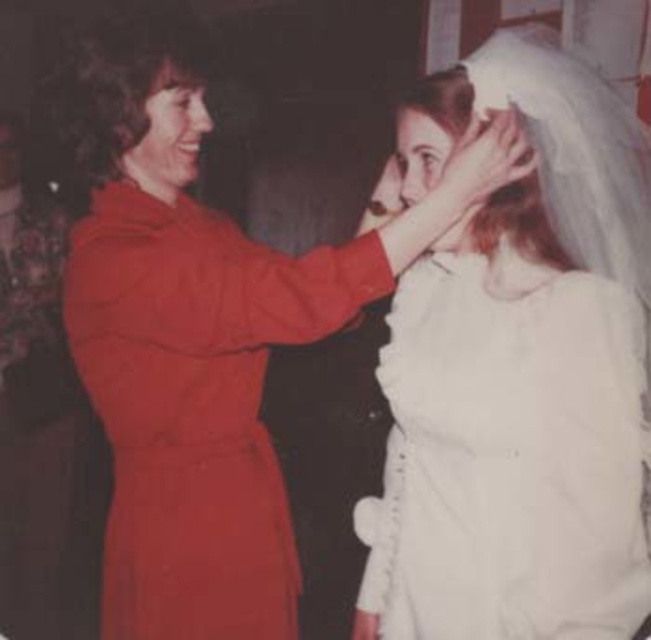
Looking at this image, how much distance is there between white satin veil at upper center and matte red dress at center?

They are 10.32 inches apart.

Who is taller, white satin veil at upper center or matte red dress at center?

With more height is white satin veil at upper center.

In order to click on white satin veil at upper center in this screenshot , I will do pos(518,371).